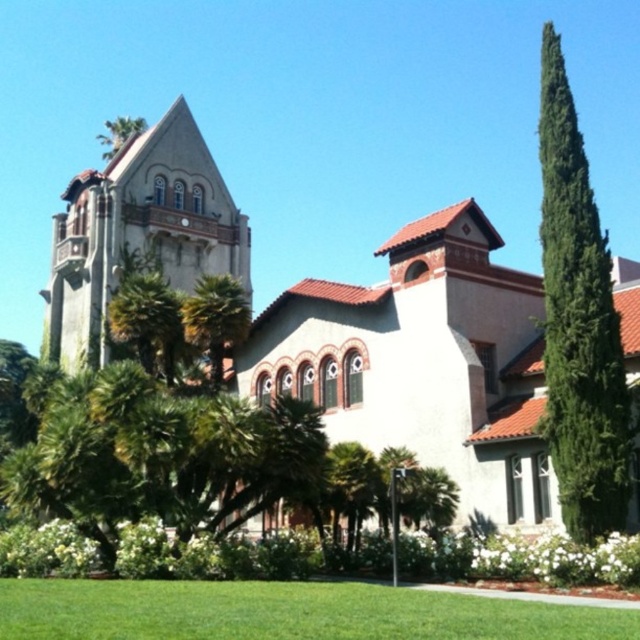
You are standing in a plaza and see the white stucco church at center and the rustic stone chapel at upper left. Which building is closer to you?

The white stucco church at center is closer to you because it is in front of the rustic stone chapel at upper left.

You are standing in front of the building and notice a specific point marked at coordinates point (285, 612). What is located at that point?

The green grass at lower center is located at point (285, 612).

You are standing in front of the building and want to walk from the green grass at lower center to the rustic stone chapel at upper left. Which direction should you move to get closer to the chapel?

You should move towards the upper left direction to get closer to the rustic stone chapel at upper left since it is located at the upper left of the building, while the green grass at lower center is positioned at the lower center.